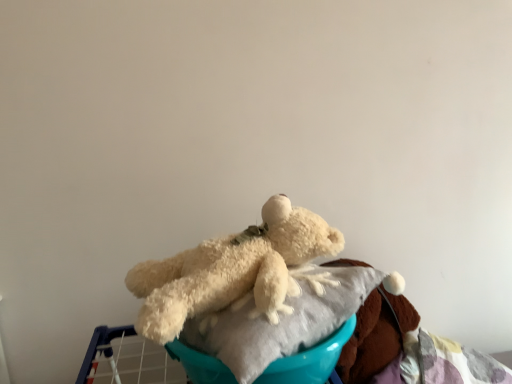
Describe the element at coordinates (232, 270) in the screenshot. This screenshot has height=384, width=512. I see `fluffy white teddy bear at center` at that location.

Locate an element on the screen. This screenshot has height=384, width=512. fluffy white teddy bear at center is located at coordinates (232, 270).

This screenshot has height=384, width=512. Find the location of `fluffy white teddy bear at center`. fluffy white teddy bear at center is located at coordinates (232, 270).